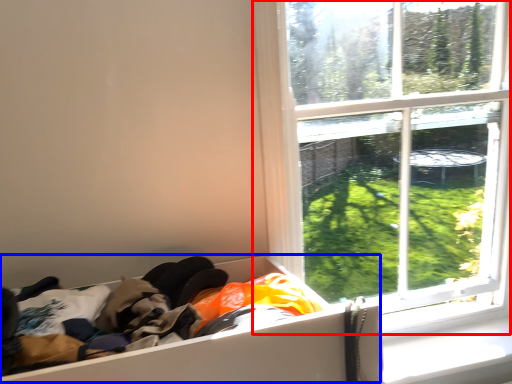
Question: Which of the following is the farthest to the observer, window (highlighted by a red box) or storage box (highlighted by a blue box)?

Choices:
 (A) window
 (B) storage box

Answer: (A)